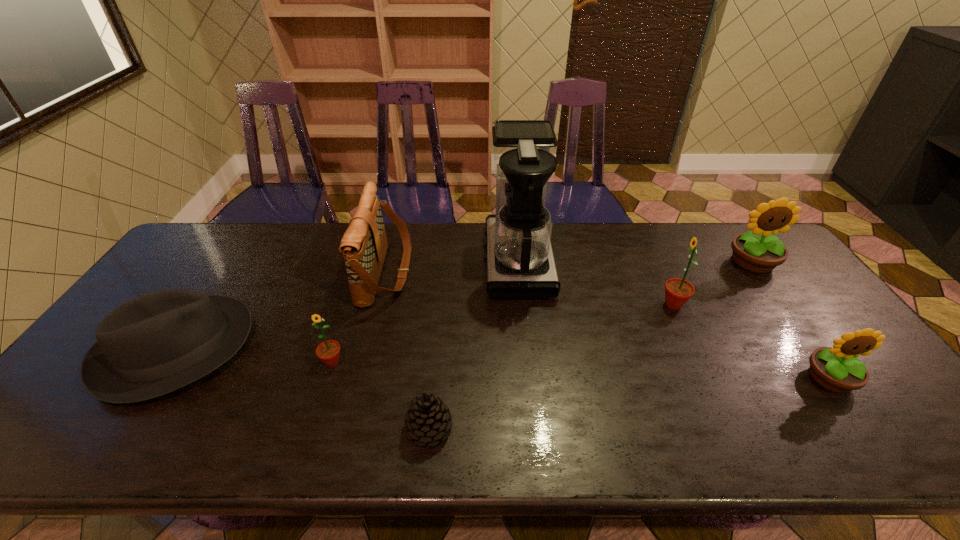
The width and height of the screenshot is (960, 540). I want to click on vacant space situated on the face of the sixth object from left to right, so click(x=540, y=305).

What are the coordinates of `blank area located on the front-facing side of the shoulder bag` in the screenshot? It's located at (501, 272).

The width and height of the screenshot is (960, 540). What are the coordinates of `vacant region located 0.120m on the face of the smaller yellow sunflower` in the screenshot? It's located at coord(878,447).

Where is `free space located on the face of the smaller green sunflower`? The height and width of the screenshot is (540, 960). free space located on the face of the smaller green sunflower is located at coordinates (317, 410).

Locate an element on the screen. The image size is (960, 540). vacant space positioned on the back of the leftmost object is located at coordinates pyautogui.click(x=231, y=266).

This screenshot has height=540, width=960. I want to click on vacant space situated 0.370m at the narrow end of the shortest object, so click(618, 428).

Locate an element on the screen. The image size is (960, 540). coffee maker that is positioned at the far edge is located at coordinates (520, 264).

The width and height of the screenshot is (960, 540). Find the location of `sunflower situated at the far edge`. sunflower situated at the far edge is located at coordinates (759, 251).

I want to click on shoulder bag at the far edge, so click(364, 245).

You are a GUI agent. You are given a task and a screenshot of the screen. Output one action in this format:
    pyautogui.click(x=<x>, y=<y>)
    Task: Click on the object that is positioned at the near edge
    
    Given the screenshot: What is the action you would take?
    pyautogui.click(x=427, y=419)